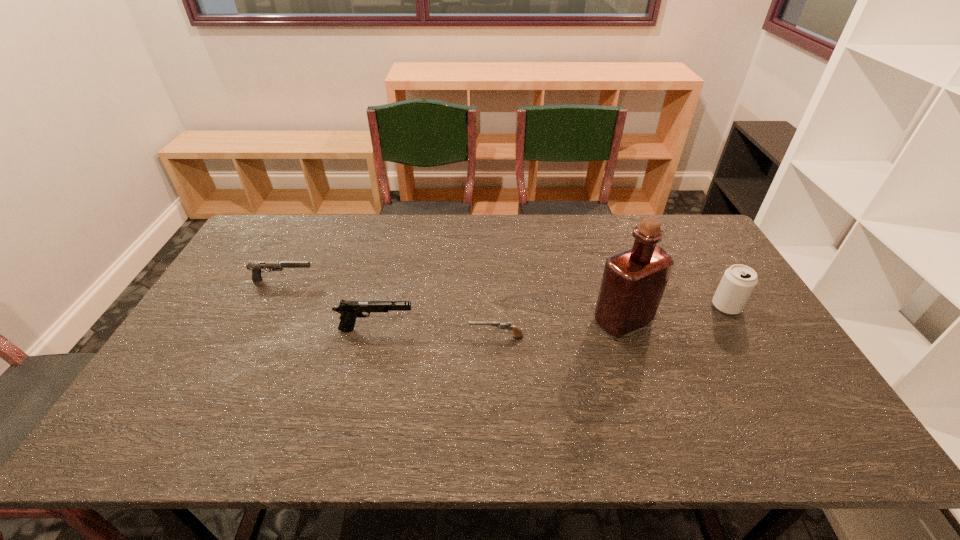
Identify the location of vacant area that lies between the shortest gun and the fourth object from left to right. (560, 328).

Identify the location of vacant area between the fourth object from right to left and the second tallest gun. (329, 305).

At what (x,y) coordinates should I click in order to perform the action: click on free spot between the liquor and the third object from left to right. Please return your answer as a coordinate pair (x, y). The height and width of the screenshot is (540, 960). Looking at the image, I should click on (560, 328).

Image resolution: width=960 pixels, height=540 pixels. I want to click on object that is the closest to the farthest gun, so click(x=350, y=310).

Identify which object is located as the third nearest to the rightmost object. Please provide its 2D coordinates. Your answer should be formatted as a tuple, i.e. [(x, y)], where the tuple contains the x and y coordinates of a point satisfying the conditions above.

[(350, 310)]

Locate which gun ranks in proximity to the second object from left to right. Please provide its 2D coordinates. Your answer should be formatted as a tuple, i.e. [(x, y)], where the tuple contains the x and y coordinates of a point satisfying the conditions above.

[(507, 325)]

Where is `the third closest gun to the second tallest object`? Image resolution: width=960 pixels, height=540 pixels. the third closest gun to the second tallest object is located at coordinates [255, 267].

I want to click on free space that satisfies the following two spatial constraints: 1. at the muzzle end of the liquor; 2. on the right side of the leftmost object, so click(x=263, y=320).

What are the coordinates of `vacant position in the image that satisfies the following two spatial constraints: 1. at the muzzle end of the farthest object; 2. on the left side of the fourth shortest object` in the screenshot? It's located at (269, 307).

The height and width of the screenshot is (540, 960). What are the coordinates of `free space that satisfies the following two spatial constraints: 1. at the muzzle end of the leftmost object; 2. on the right side of the second object from right to left` in the screenshot? It's located at (263, 320).